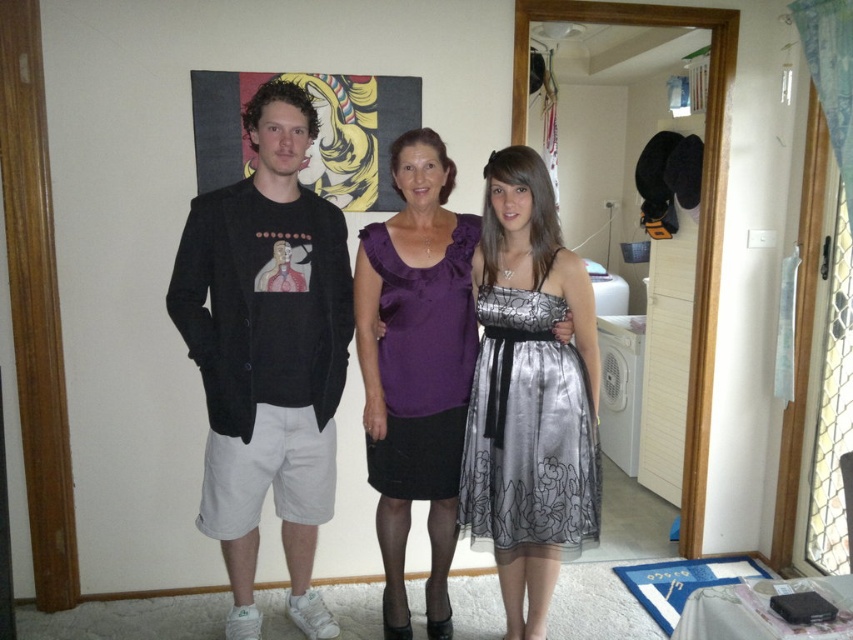
Question: Estimate the real-world distances between objects in this image. Which object is farther from the silky purple blouse at center?

Choices:
 (A) black cotton t-shirt at left
 (B) silver satin dress at center

Answer: (A)

Question: Does black cotton t-shirt at left have a larger size compared to silver satin dress at center?

Choices:
 (A) yes
 (B) no

Answer: (A)

Question: Can you confirm if silky purple blouse at center is positioned to the right of purple satin dress at center?

Choices:
 (A) no
 (B) yes

Answer: (B)

Question: Which object is positioned farthest from the silver satin dress at center?

Choices:
 (A) black cotton t-shirt at left
 (B) purple satin dress at center
 (C) silky purple blouse at center

Answer: (A)

Question: Does black cotton t-shirt at left lie behind purple satin dress at center?

Choices:
 (A) no
 (B) yes

Answer: (A)

Question: Among these points, which one is farthest from the camera?

Choices:
 (A) (308, 586)
 (B) (524, 248)
 (C) (482, 321)

Answer: (A)